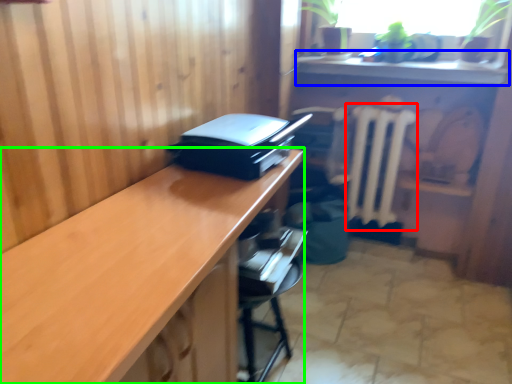
Question: Which object is positioned closest to radiator (highlighted by a red box)? Select from counter top (highlighted by a blue box) and desk (highlighted by a green box).

Choices:
 (A) counter top
 (B) desk

Answer: (A)